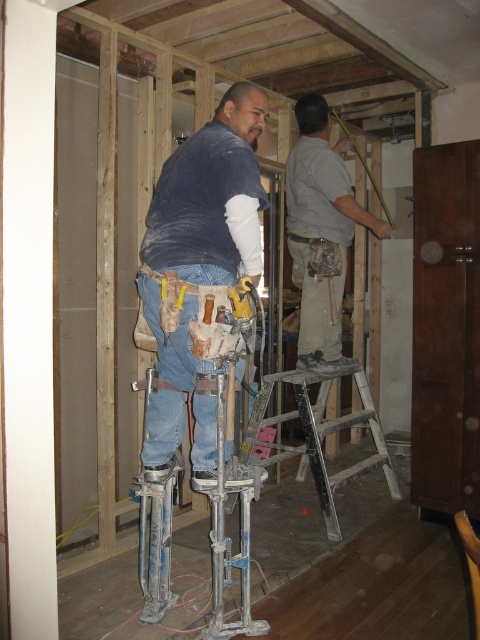
What are the coordinates of the blue denim jeans at center?

The blue denim jeans at center are located at point [200,244].

You are a safety inspector observing the construction scene. You notice the blue denim jeans at center and the gray fabric shirt at upper center. Based on their positions, which object is closer to you?

The blue denim jeans at center is closer to you because it is in front of the gray fabric shirt at upper center.

You are a safety inspector observing the construction scene. You notice the blue denim jeans at center and the yellow plastic hammer at center. According to safety protocols, which object should be prioritized for inspection to ensure worker safety?

The yellow plastic hammer at center should be prioritized for inspection because the blue denim jeans at center is in front of it, potentially obstructing the hammer and making it harder to assess its safety condition properly.